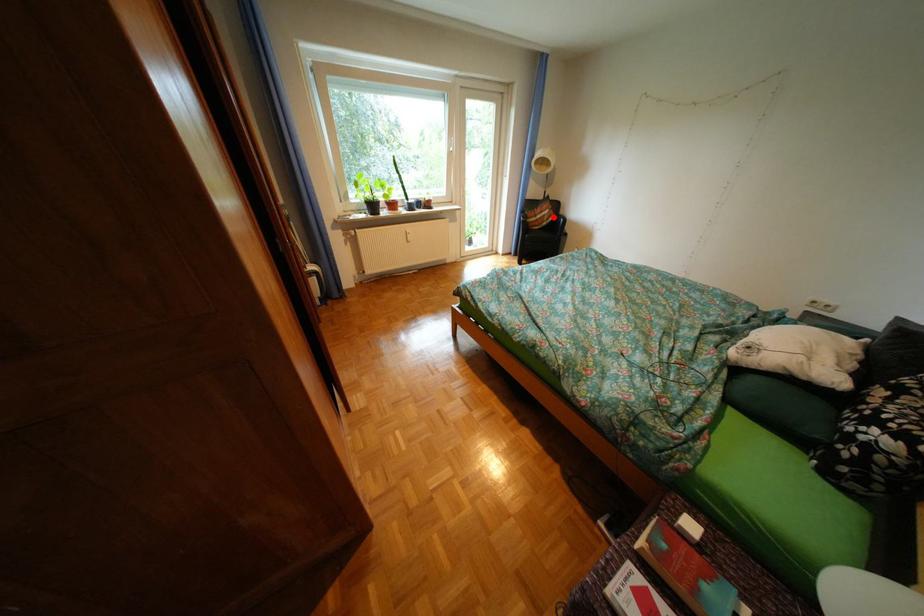
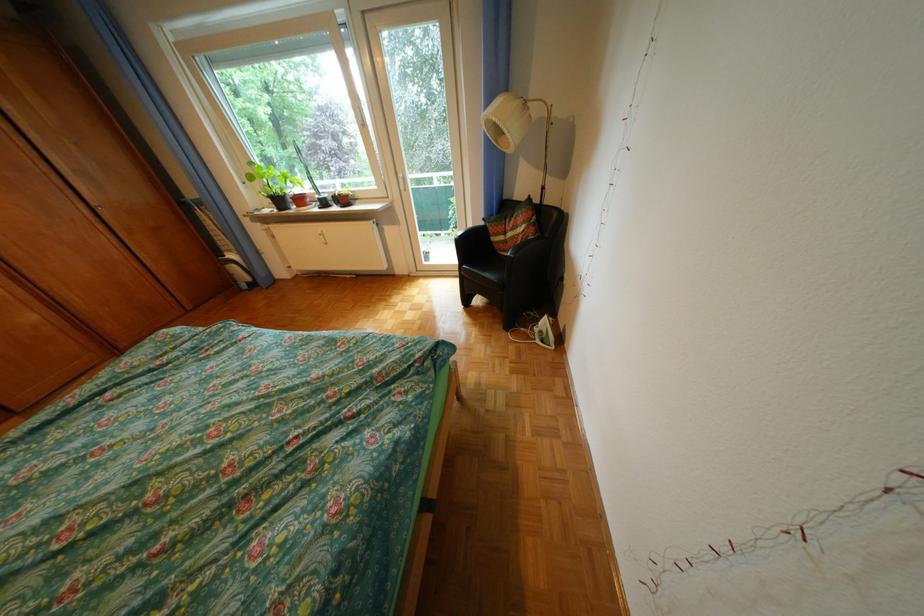
Question: A red point is marked in image1. In image2, is the corresponding 3D point closer to the camera or farther? Reply with the corresponding letter.

Choices:
 (A) The corresponding 3D point is closer.
 (B) The corresponding 3D point is farther.

Answer: (B)